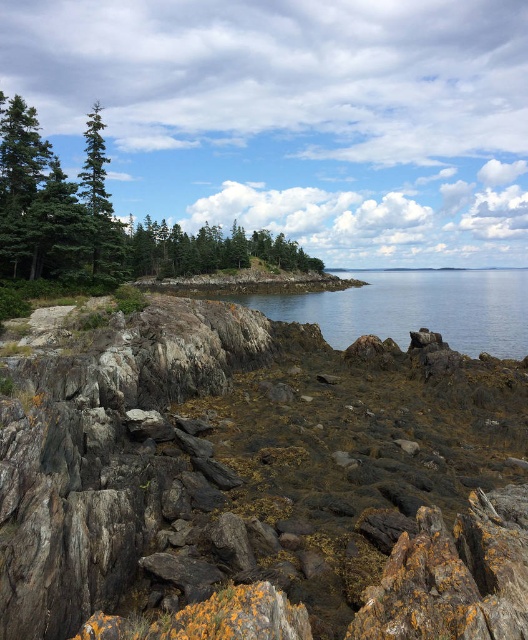
Between rusty rock at center and green matte tree at upper left, which one is positioned higher?

green matte tree at upper left is above.

At what (x,y) coordinates should I click in order to perform the action: click on rusty rock at center. Please return your answer as a coordinate pair (x, y). Looking at the image, I should click on (259, 483).

Is rusty rock at center below green matte trees at center?

Indeed, rusty rock at center is positioned under green matte trees at center.

Is point (495, 500) positioned behind point (205, 248)?

That is False.

Describe the element at coordinates (259, 483) in the screenshot. I see `rusty rock at center` at that location.

Locate an element on the screen. The width and height of the screenshot is (528, 640). rusty rock at center is located at coordinates (259, 483).

Is point (73, 266) positioned after point (140, 253)?

No, it is in front of (140, 253).

What are the coordinates of `green matte tree at upper left` in the screenshot? It's located at (101, 220).